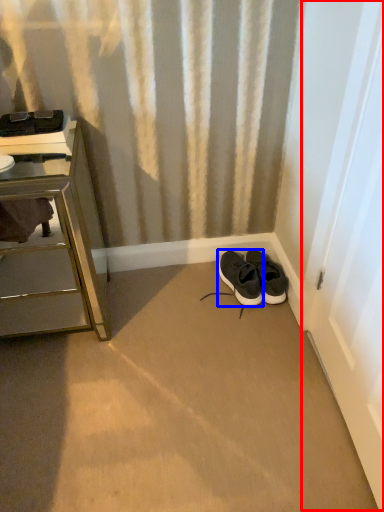
Question: Among these objects, which one is farthest to the camera, screen door (highlighted by a red box) or shoe (highlighted by a blue box)?

Choices:
 (A) screen door
 (B) shoe

Answer: (B)